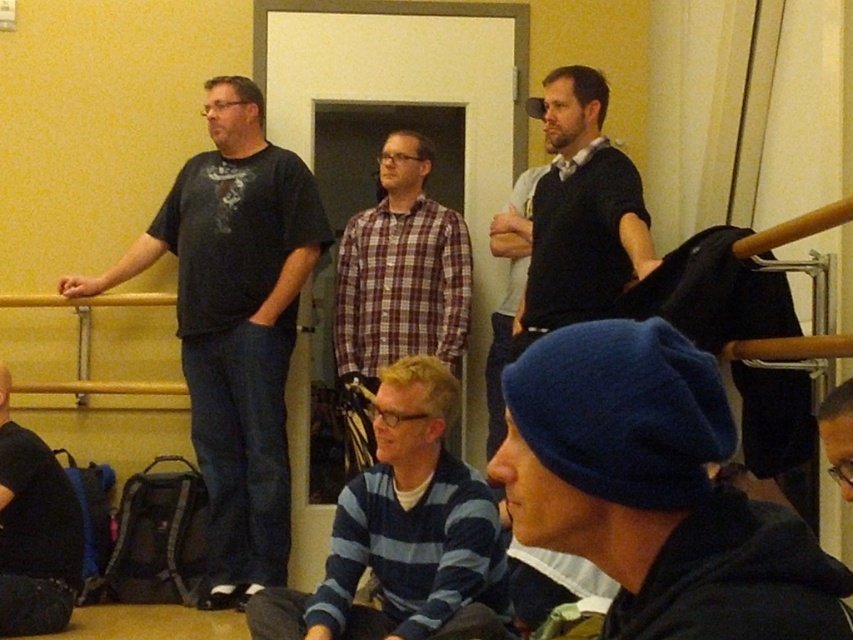
You are organizing a clothing drive and need to determine if the blue striped sweater at center can fit into a donation box that has a maximum capacity for items smaller than the smooth black hair at upper right. Can the sweater fit?

The blue striped sweater at center is bigger than the smooth black hair at upper right, so it cannot fit into the donation box with the size restriction.

You are a photographer trying to capture a candid shot of the blue striped sweater at center and smooth black hair at upper right. Which object should you focus on first if you want to capture both in a single frame without moving the camera?

The blue striped sweater at center is located below smooth black hair at upper right, so you should focus on the smooth black hair at upper right first since it is higher up and can be captured in the frame along with the lower positioned blue striped sweater at center.

You are a photographer trying to capture a candid shot of the blue knit cap at lower left without including the smooth black hair at upper right in the frame. Based on their positions, is this possible?

The smooth black hair at upper right is behind the blue knit cap at lower left, so yes, the photographer can capture the blue knit cap at lower left without including the smooth black hair at upper right by focusing on the foreground subject.